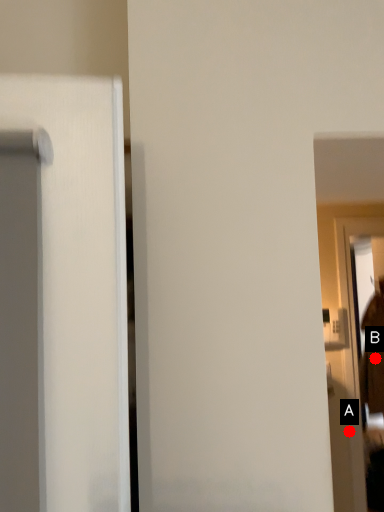
Question: Two points are circled on the image, labeled by A and B beside each circle. Which point appears closest to the camera in this image?

Choices:
 (A) A is closer
 (B) B is closer

Answer: (A)